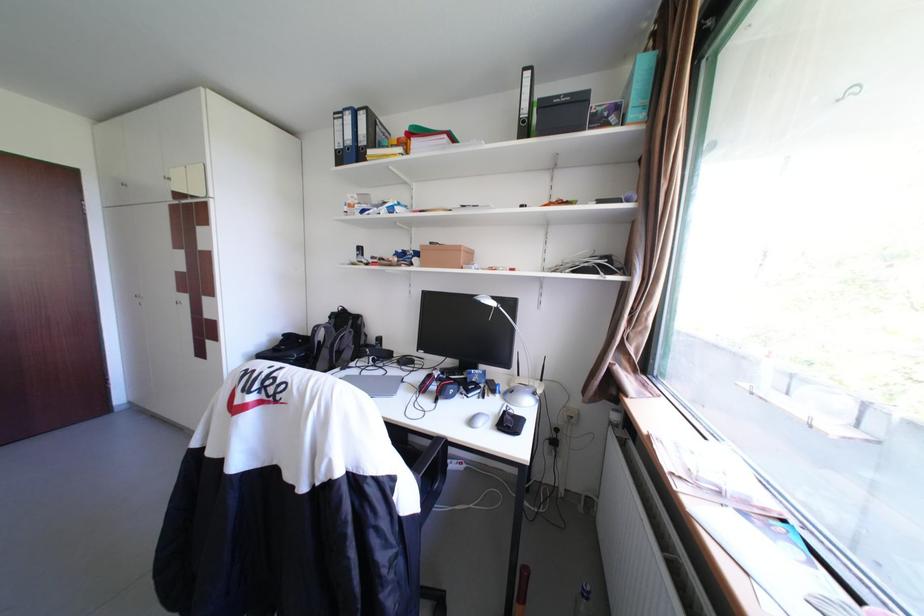
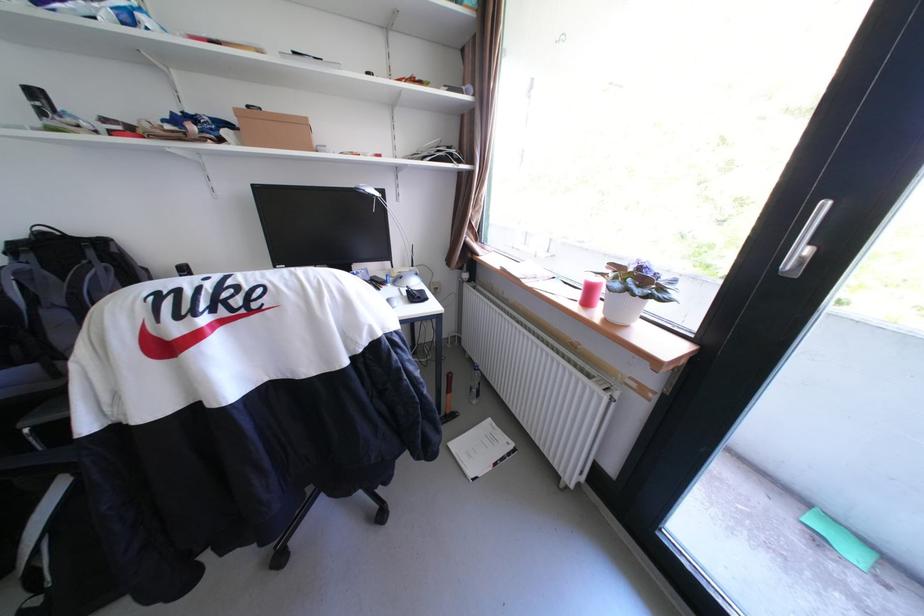
In the second image, find the point that corresponds to pixel 432 246 in the first image.

(247, 111)